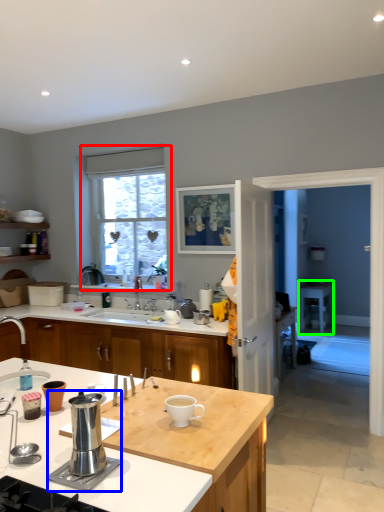
Question: Considering the real-world distances, which object is closest to window (highlighted by a red box)? appliance (highlighted by a blue box) or desk (highlighted by a green box).

Choices:
 (A) appliance
 (B) desk

Answer: (B)